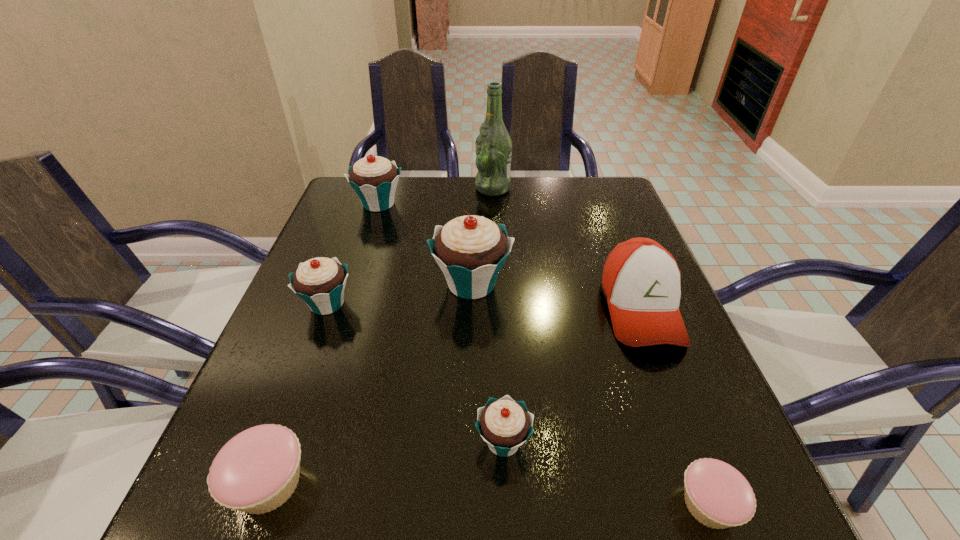
Identify the location of the bigger pink cupcake. [x=256, y=471].

Locate an element on the screen. the fifth tallest cupcake is located at coordinates (256, 471).

Locate an element on the screen. Image resolution: width=960 pixels, height=540 pixels. the shortest object is located at coordinates (718, 496).

Find the location of a particular element. the shortest cupcake is located at coordinates (718, 496).

Image resolution: width=960 pixels, height=540 pixels. In order to click on free spot located on the surface of the green beer bottle in this screenshot , I will do coord(410,188).

This screenshot has width=960, height=540. Find the location of `vacant point located 0.050m on the surface of the green beer bottle`. vacant point located 0.050m on the surface of the green beer bottle is located at coordinates (458, 188).

Locate an element on the screen. This screenshot has height=540, width=960. vacant area situated on the surface of the green beer bottle is located at coordinates (451, 188).

What are the coordinates of `vacant space located 0.240m on the right of the second tallest object` in the screenshot? It's located at (621, 284).

You are a GUI agent. You are given a task and a screenshot of the screen. Output one action in this format:
    pyautogui.click(x=<x>, y=<y>)
    Task: Click on the vacant region located on the right of the farthest cupcake
    
    Given the screenshot: What is the action you would take?
    click(422, 204)

Image resolution: width=960 pixels, height=540 pixels. Find the location of `free region located on the front-facing side of the baseball cap`. free region located on the front-facing side of the baseball cap is located at coordinates (698, 458).